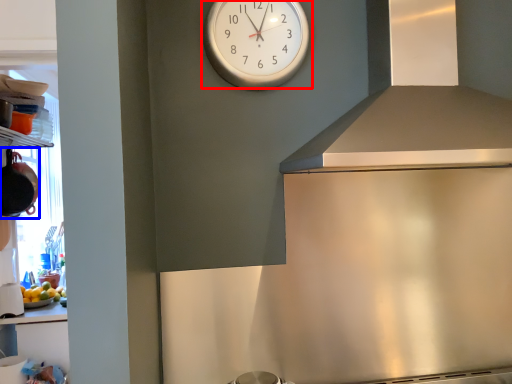
Question: Among these objects, which one is nearest to the camera, wall clock (highlighted by a red box) or appliance (highlighted by a blue box)?

Choices:
 (A) wall clock
 (B) appliance

Answer: (A)